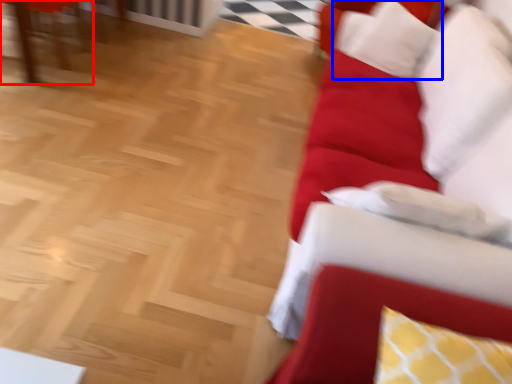
Question: Which object is closer to the camera taking this photo, furniture (highlighted by a red box) or pillow (highlighted by a blue box)?

Choices:
 (A) furniture
 (B) pillow

Answer: (B)